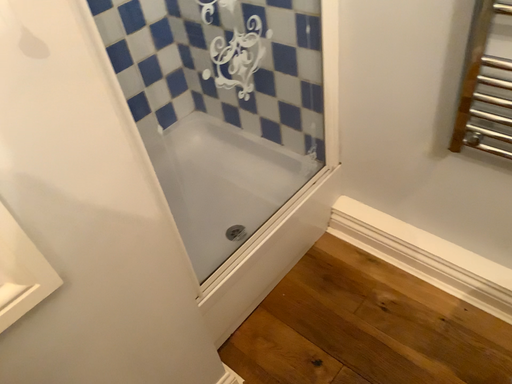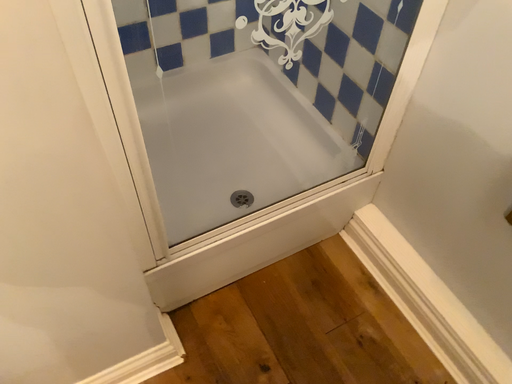
Question: Which way did the camera rotate in the video?

Choices:
 (A) rotated right
 (B) rotated left

Answer: (B)